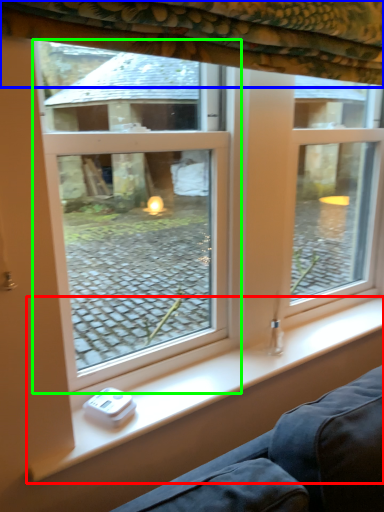
Question: Which object is positioned farthest from window sill (highlighted by a red box)? Select from curtain (highlighted by a blue box) and window (highlighted by a green box).

Choices:
 (A) curtain
 (B) window

Answer: (B)